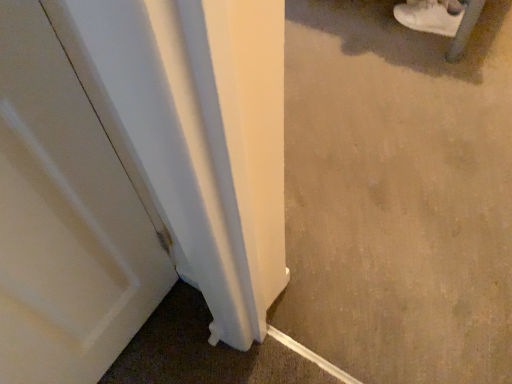
Question: From the image's perspective, is white suede shoe at upper right above beige carpet at lower right?

Choices:
 (A) yes
 (B) no

Answer: (A)

Question: Is white suede shoe at upper right completely or partially outside of beige carpet at lower right?

Choices:
 (A) no
 (B) yes

Answer: (B)

Question: Considering the relative sizes of white suede shoe at upper right and beige carpet at lower right in the image provided, is white suede shoe at upper right thinner than beige carpet at lower right?

Choices:
 (A) no
 (B) yes

Answer: (B)

Question: From a real-world perspective, is white suede shoe at upper right located higher than beige carpet at lower right?

Choices:
 (A) no
 (B) yes

Answer: (A)

Question: Does white suede shoe at upper right have a greater height compared to beige carpet at lower right?

Choices:
 (A) no
 (B) yes

Answer: (A)

Question: Is the depth of white suede shoe at upper right less than that of beige carpet at lower right?

Choices:
 (A) no
 (B) yes

Answer: (A)

Question: Considering the relative positions of beige carpet at lower right and white suede shoe at upper right in the image provided, is beige carpet at lower right behind white suede shoe at upper right?

Choices:
 (A) yes
 (B) no

Answer: (B)

Question: From a real-world perspective, is beige carpet at lower right located higher than white suede shoe at upper right?

Choices:
 (A) yes
 (B) no

Answer: (A)

Question: Is beige carpet at lower right shorter than white suede shoe at upper right?

Choices:
 (A) yes
 (B) no

Answer: (B)

Question: Is beige carpet at lower right aimed at white suede shoe at upper right?

Choices:
 (A) no
 (B) yes

Answer: (A)

Question: Can you confirm if beige carpet at lower right is positioned to the left of white suede shoe at upper right?

Choices:
 (A) no
 (B) yes

Answer: (B)

Question: Is beige carpet at lower right outside of white suede shoe at upper right?

Choices:
 (A) yes
 (B) no

Answer: (A)

Question: From the image's perspective, is beige carpet at lower right located above or below white suede shoe at upper right?

Choices:
 (A) above
 (B) below

Answer: (B)